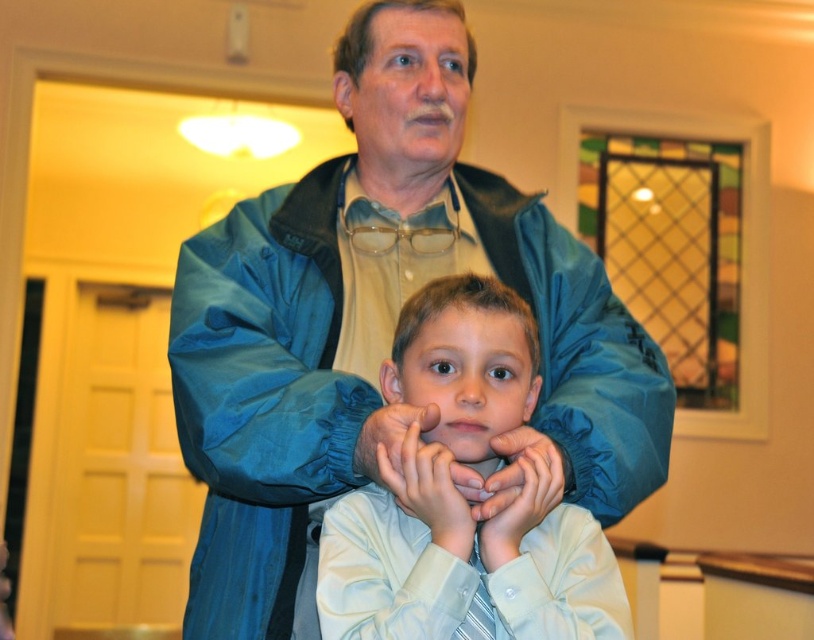
Question: Considering the real-world distances, which object is farthest from the matte blue hand at center?

Choices:
 (A) light blue shirt at center
 (B) blue nylon jacket at center
 (C) matte skin hand at center

Answer: (B)

Question: Is the position of blue nylon jacket at center less distant than that of blue fabric hand at center?

Choices:
 (A) no
 (B) yes

Answer: (B)

Question: Is matte skin hand at center further to camera compared to matte blue hand at center?

Choices:
 (A) no
 (B) yes

Answer: (A)

Question: Which object appears farthest from the camera in this image?

Choices:
 (A) matte blue hand at center
 (B) light blue shirt at center

Answer: (A)

Question: Which object appears closest to the camera in this image?

Choices:
 (A) blue fabric hand at center
 (B) matte skin hand at center
 (C) matte blue hand at center

Answer: (B)

Question: Does blue nylon jacket at center have a larger size compared to matte skin hand at center?

Choices:
 (A) yes
 (B) no

Answer: (A)